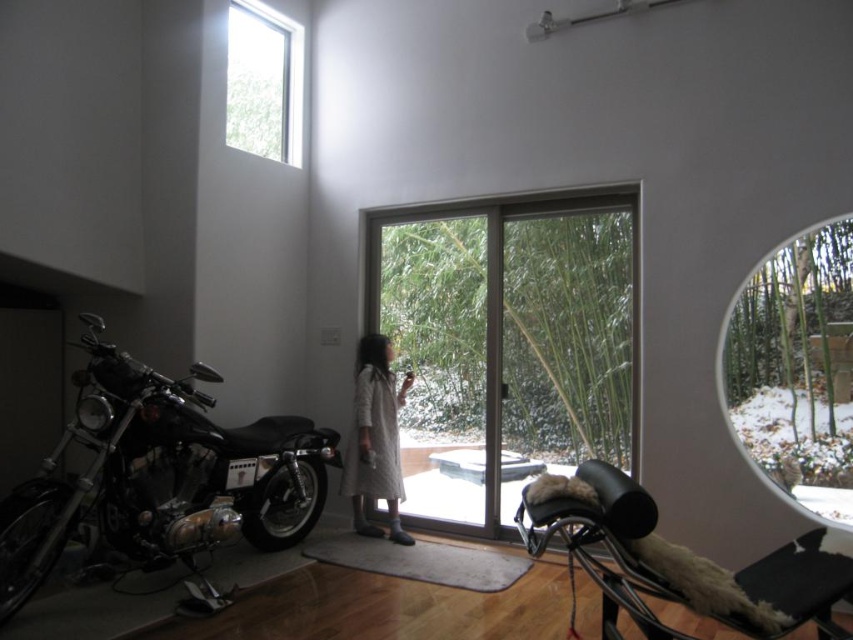
Question: Which object appears farthest from the camera in this image?

Choices:
 (A) clear glass window at upper left
 (B) transparent glass window at upper right
 (C) shiny chrome motorcycle at center

Answer: (A)

Question: Does transparent glass window at upper right appear under clear glass window at upper left?

Choices:
 (A) no
 (B) yes

Answer: (B)

Question: Which of the following is the farthest from the observer?

Choices:
 (A) white textured coat at center
 (B) shiny black motorcycle at left
 (C) clear glass window at upper left
 (D) shiny chrome motorcycle at center

Answer: (C)

Question: Which of these objects is positioned farthest from the white textured coat at center?

Choices:
 (A) transparent glass window at upper right
 (B) shiny chrome motorcycle at center
 (C) clear glass window at upper left

Answer: (A)

Question: From the image, what is the correct spatial relationship of clear glass screen door at center in relation to shiny chrome motorcycle at center?

Choices:
 (A) above
 (B) below

Answer: (A)

Question: Can you confirm if shiny chrome motorcycle at center is thinner than white textured coat at center?

Choices:
 (A) yes
 (B) no

Answer: (B)